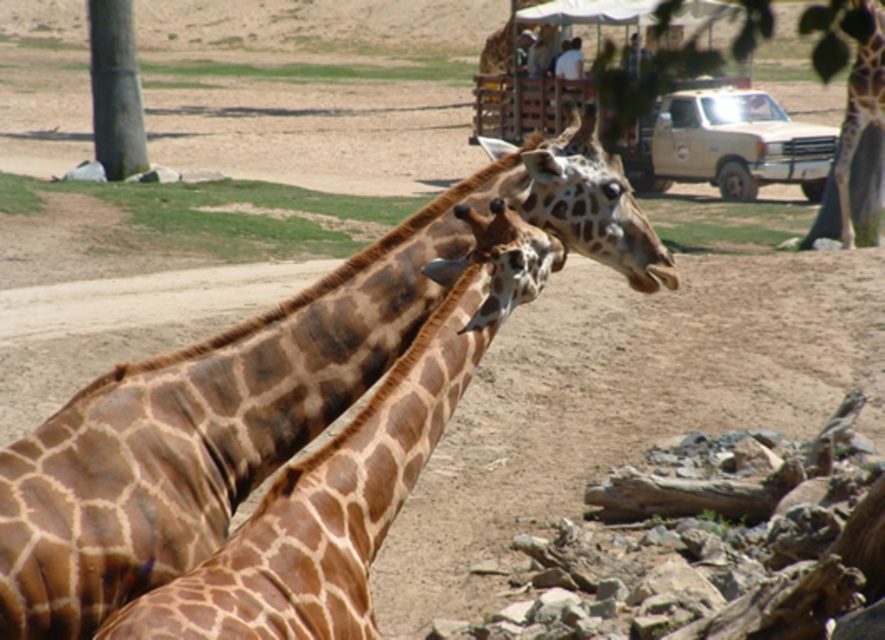
Which of these two, brown spotted giraffe at center or green bark tree at left, stands taller?

With more height is green bark tree at left.

Based on the photo, who is lower down, brown spotted giraffe at center or green bark tree at left?

Positioned lower is brown spotted giraffe at center.

Is point (297, 554) in front of point (129, 32)?

Yes, point (297, 554) is closer to viewer.

The height and width of the screenshot is (640, 885). I want to click on brown spotted giraffe at center, so 352,470.

In the scene shown: Does brown spotted giraffe at center appear on the left side of beige matte truck at upper right?

Correct, you'll find brown spotted giraffe at center to the left of beige matte truck at upper right.

Image resolution: width=885 pixels, height=640 pixels. Describe the element at coordinates (352, 470) in the screenshot. I see `brown spotted giraffe at center` at that location.

Identify the location of brown spotted giraffe at center. The width and height of the screenshot is (885, 640). (352, 470).

Is green bark tree at left bigger than brown spotted giraffe at right?

Yes.

Is green bark tree at left to the left of brown spotted giraffe at right from the viewer's perspective?

Indeed, green bark tree at left is positioned on the left side of brown spotted giraffe at right.

What do you see at coordinates (114, 90) in the screenshot? The image size is (885, 640). I see `green bark tree at left` at bounding box center [114, 90].

The width and height of the screenshot is (885, 640). In order to click on green bark tree at left in this screenshot , I will do `click(114, 90)`.